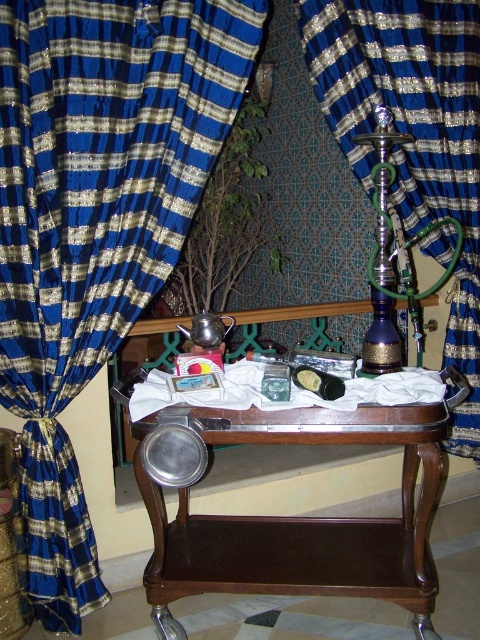
You are a decorator trying to hang a picture frame between the blue silk curtain at left and the blue silk curtain at center. The frame requires 80 centimeters of space. Is there enough space between them?

The blue silk curtain at left is 90.12 centimeters from blue silk curtain at center, so yes, there is enough space to hang the picture frame between them since the distance is greater than 80 centimeters.

You are arranging flowers in a vase. The brown wood table at center is where you want to place the vase. However, there is an obstacle blocking the direct path from the blue silk curtain at center to the table. Can you move the vase from the curtain to the table without moving the obstacle?

The brown wood table at center is below the blue silk curtain at center, so you can move the vase from the curtain to the table by going around the obstacle since they are vertically aligned.

You are arranging a party and need to decide which item to move first. Since you want to use the space where the smaller item is located, which object should you move first between the blue silk curtain at left and the brown wood table at center?

The blue silk curtain at left has a smaller size compared to the brown wood table at center, so you should move the blue silk curtain at left first to free up space.